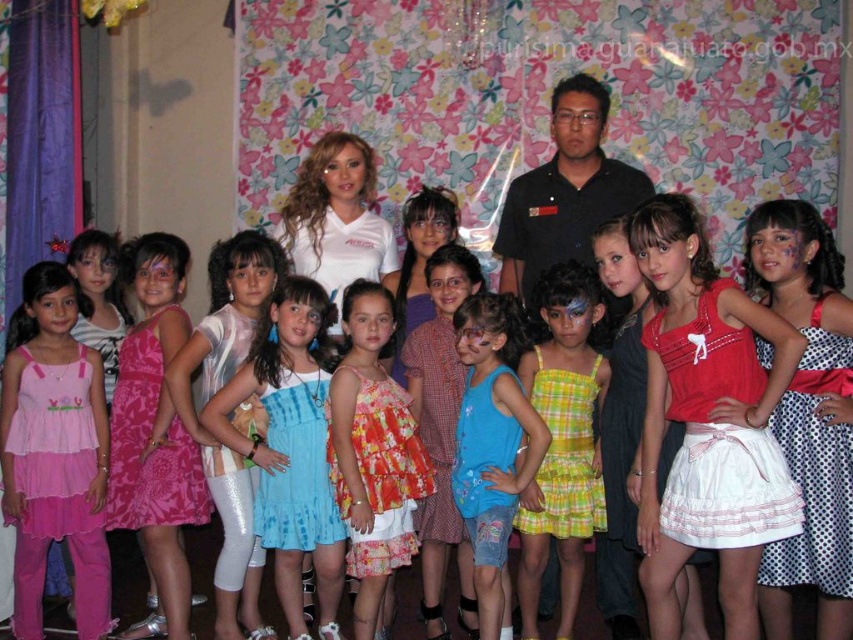
From the picture: You are standing in front of the group photo setup. There are two points marked in the scene. The first point is at coordinate point (650, 513) and the second point is at coordinate point (556, 540). Which point is closer to you?

Point (650, 513) is closer to the viewer than point (556, 540).

You are standing in front of the group photo setup. There is a point at coordinates (x=706, y=420) in the image. What object is located at that point?

The point at coordinates (x=706, y=420) corresponds to the matte red blouse at center.